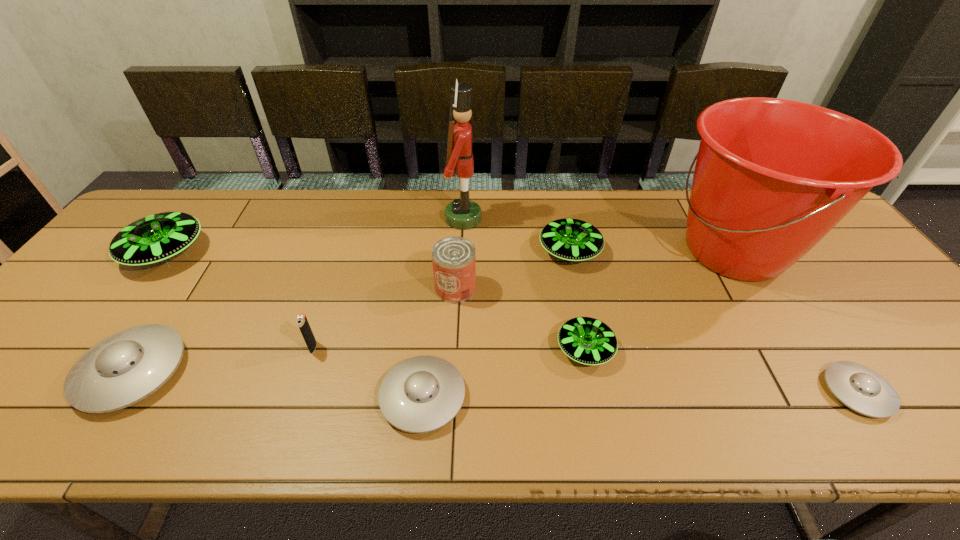
Locate an element on the screen. The width and height of the screenshot is (960, 540). green nutcracker is located at coordinates (463, 213).

Image resolution: width=960 pixels, height=540 pixels. What are the coordinates of `the tallest object` in the screenshot? It's located at (463, 213).

Where is `bucket`? bucket is located at coordinates (773, 176).

Find the location of `the ninth shortest object`. the ninth shortest object is located at coordinates (773, 176).

The width and height of the screenshot is (960, 540). In order to click on can in this screenshot , I will do `click(454, 258)`.

Where is `the tallest saucer`? The width and height of the screenshot is (960, 540). the tallest saucer is located at coordinates (156, 238).

Image resolution: width=960 pixels, height=540 pixels. Find the location of `the leftmost green saucer`. the leftmost green saucer is located at coordinates (156, 238).

At what (x,y) coordinates should I click in order to perform the action: click on the eighth object from right to left. Please return your answer as a coordinate pair (x, y). Looking at the image, I should click on (302, 322).

The width and height of the screenshot is (960, 540). I want to click on igniter, so click(302, 322).

Identify the location of the second tallest saucer. This screenshot has height=540, width=960. (569, 239).